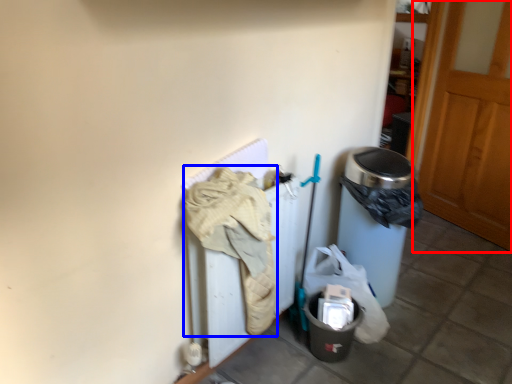
Question: Among these objects, which one is farthest to the camera, door (highlighted by a red box) or clothing (highlighted by a blue box)?

Choices:
 (A) door
 (B) clothing

Answer: (A)